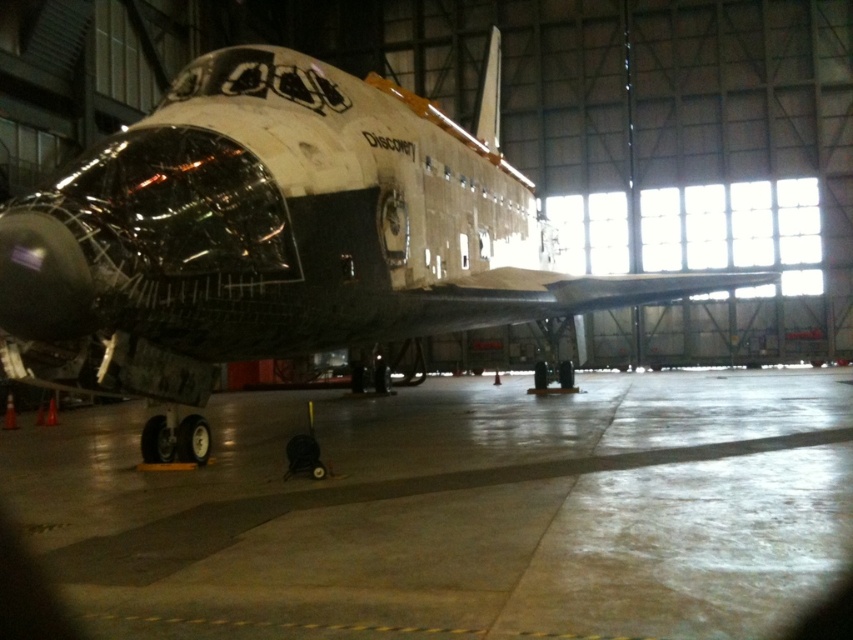
Does concrete at center appear under white matte space shuttle at center?

Yes, concrete at center is below white matte space shuttle at center.

Which is in front, point (416, 593) or point (303, 113)?

Point (416, 593) is more forward.

I want to click on concrete at center, so click(459, 512).